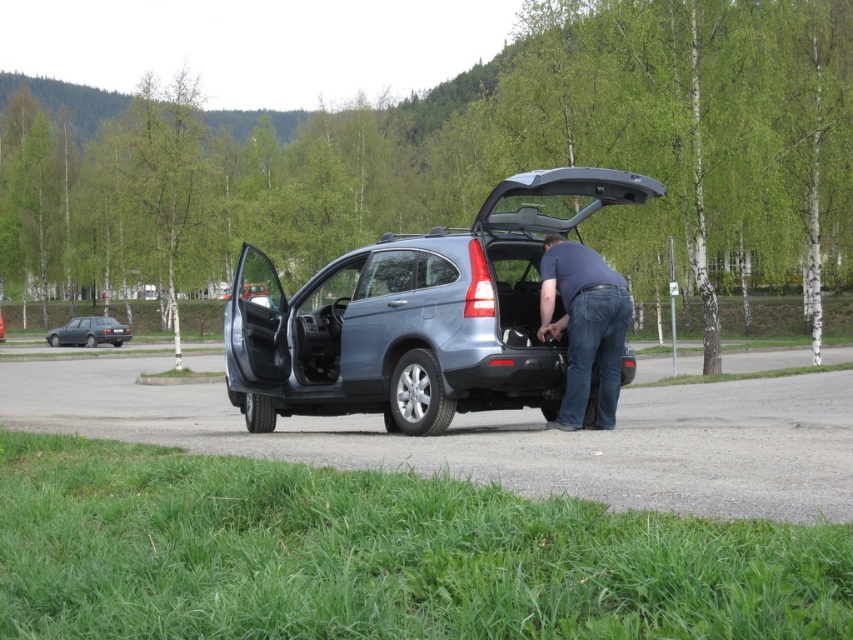
Question: Which is nearer to the dark gray metallic sedan at left?

Choices:
 (A) metallic blue suv at center
 (B) satin silver suv at center

Answer: (B)

Question: Does dark gray metallic sedan at left appear under satin silver suv at center?

Choices:
 (A) yes
 (B) no

Answer: (A)

Question: Which of the following is the farthest from the observer?

Choices:
 (A) dark blue shirt at center
 (B) satin silver suv at center

Answer: (B)

Question: Is dark blue shirt at center to the right of satin silver suv at center from the viewer's perspective?

Choices:
 (A) yes
 (B) no

Answer: (A)

Question: Which object is farther from the camera taking this photo?

Choices:
 (A) dark blue shirt at center
 (B) satin silver suv at center
 (C) metallic blue suv at center

Answer: (B)

Question: Can you confirm if dark blue shirt at center is wider than satin silver suv at center?

Choices:
 (A) no
 (B) yes

Answer: (A)